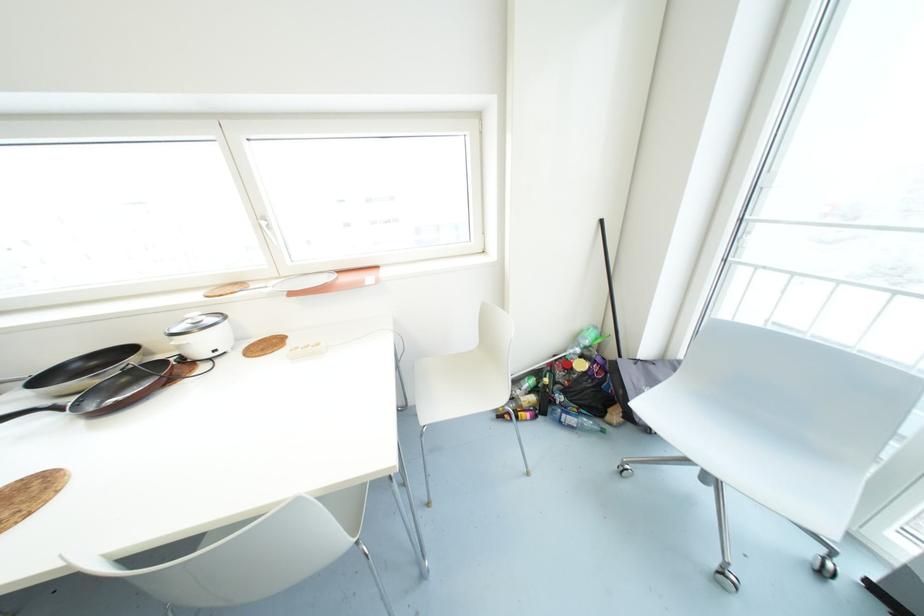
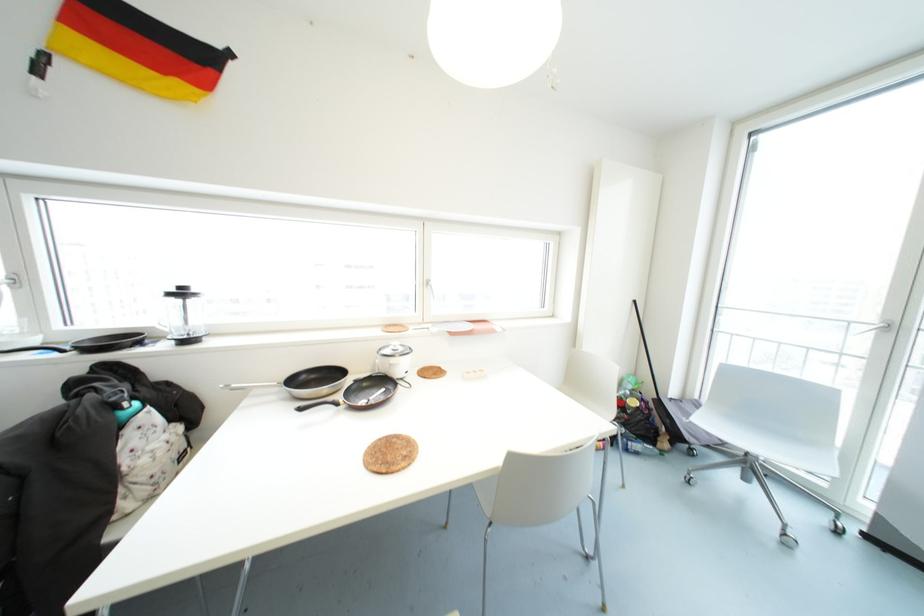
The point at (x=261, y=350) is marked in the first image. Where is the corresponding point in the second image?

(434, 374)